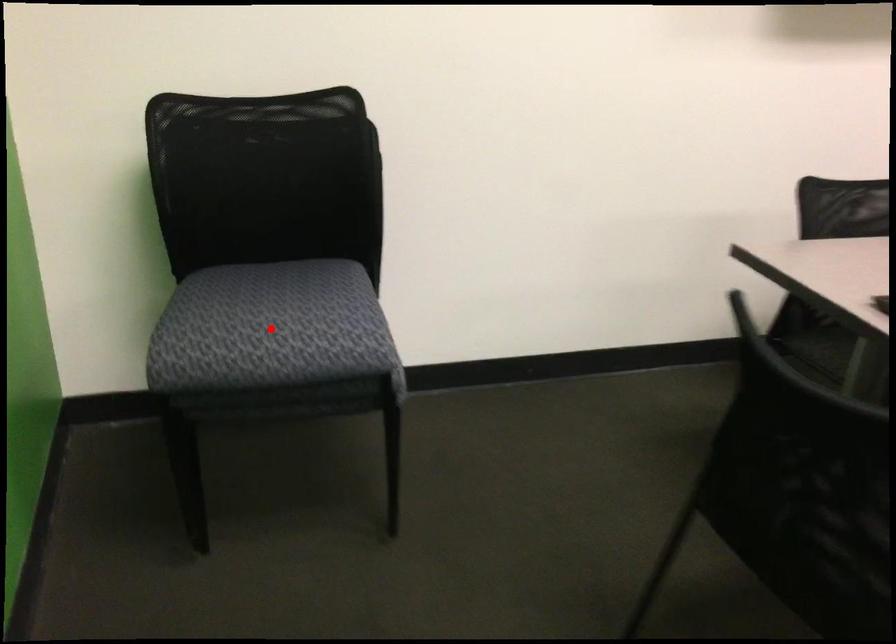
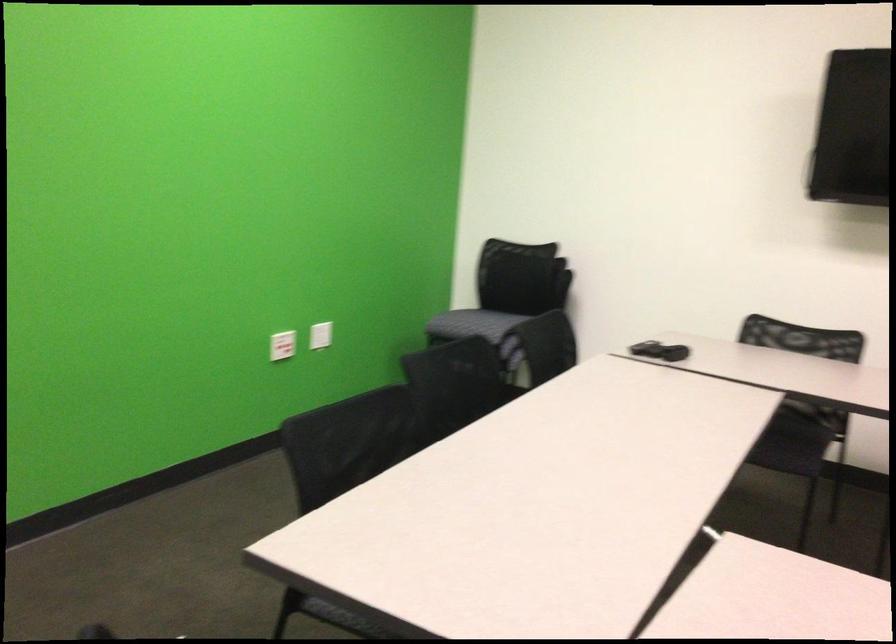
Where in the second image is the point corresponding to the highlighted location from the first image?

(457, 299)